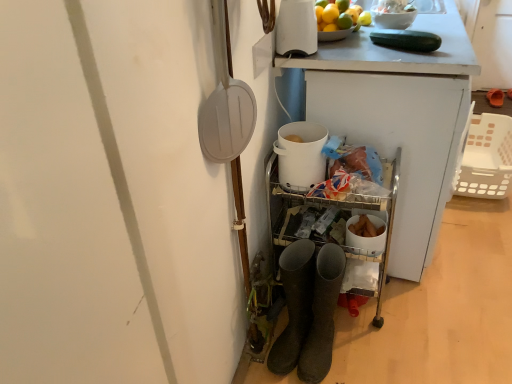
Question: In which direction should I rotate to look at white glossy kettle at upper center, which ranks as the second appliance in bottom-to-top order?

Choices:
 (A) left
 (B) right

Answer: (B)

Question: From a real-world perspective, is white plastic basket at right physically below green matte cucumber at upper right?

Choices:
 (A) no
 (B) yes

Answer: (B)

Question: Does white plastic basket at right appear on the right side of green matte cucumber at upper right?

Choices:
 (A) no
 (B) yes

Answer: (B)

Question: Is white plastic basket at right bigger than green matte cucumber at upper right?

Choices:
 (A) yes
 (B) no

Answer: (A)

Question: Is white plastic basket at right surrounding green matte cucumber at upper right?

Choices:
 (A) yes
 (B) no

Answer: (B)

Question: Is white plastic basket at right positioned behind green matte cucumber at upper right?

Choices:
 (A) no
 (B) yes

Answer: (B)

Question: Does white plastic basket at right have a smaller size compared to green matte cucumber at upper right?

Choices:
 (A) yes
 (B) no

Answer: (B)

Question: Considering the relative sizes of white matte bucket at center, the 1th appliance ordered from the bottom, and white glossy kettle at upper center, marked as the 1th appliance in a top-to-bottom arrangement, in the image provided, is white matte bucket at center, the 1th appliance ordered from the bottom, wider than white glossy kettle at upper center, marked as the 1th appliance in a top-to-bottom arrangement,?

Choices:
 (A) yes
 (B) no

Answer: (A)

Question: From a real-world perspective, is white matte bucket at center, the 1th appliance ordered from the bottom, positioned under white glossy kettle at upper center, marked as the 1th appliance in a top-to-bottom arrangement, based on gravity?

Choices:
 (A) no
 (B) yes

Answer: (B)

Question: Is white glossy kettle at upper center, which ranks as the second appliance in bottom-to-top order, at the back of white matte bucket at center, which is the 2th appliance from top to bottom?

Choices:
 (A) yes
 (B) no

Answer: (B)

Question: Is white matte bucket at center, which is the 2th appliance from top to bottom, bigger than white glossy kettle at upper center, marked as the 1th appliance in a top-to-bottom arrangement?

Choices:
 (A) no
 (B) yes

Answer: (A)

Question: Could you tell me if white matte bucket at center, which is the 2th appliance from top to bottom, is turned towards white glossy kettle at upper center, marked as the 1th appliance in a top-to-bottom arrangement?

Choices:
 (A) no
 (B) yes

Answer: (A)

Question: From the image's perspective, is white matte bucket at center, the 1th appliance ordered from the bottom, beneath white glossy kettle at upper center, which ranks as the second appliance in bottom-to-top order?

Choices:
 (A) yes
 (B) no

Answer: (A)

Question: Considering the relative sizes of white glossy bowl at upper right and white glossy kettle at upper center, marked as the 1th appliance in a top-to-bottom arrangement, in the image provided, is white glossy bowl at upper right bigger than white glossy kettle at upper center, marked as the 1th appliance in a top-to-bottom arrangement,?

Choices:
 (A) yes
 (B) no

Answer: (B)